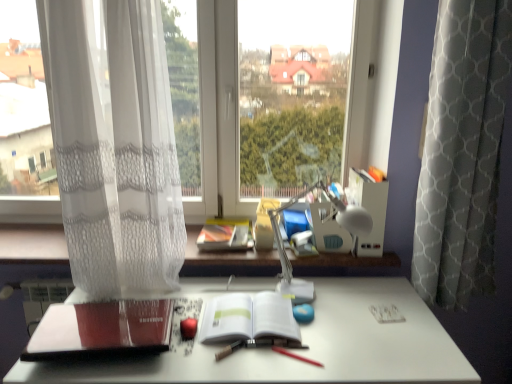
Where is `vacant space in front of white paper at center, marked as the 2th paperback book in a left-to-right arrangement`? vacant space in front of white paper at center, marked as the 2th paperback book in a left-to-right arrangement is located at coordinates (251, 365).